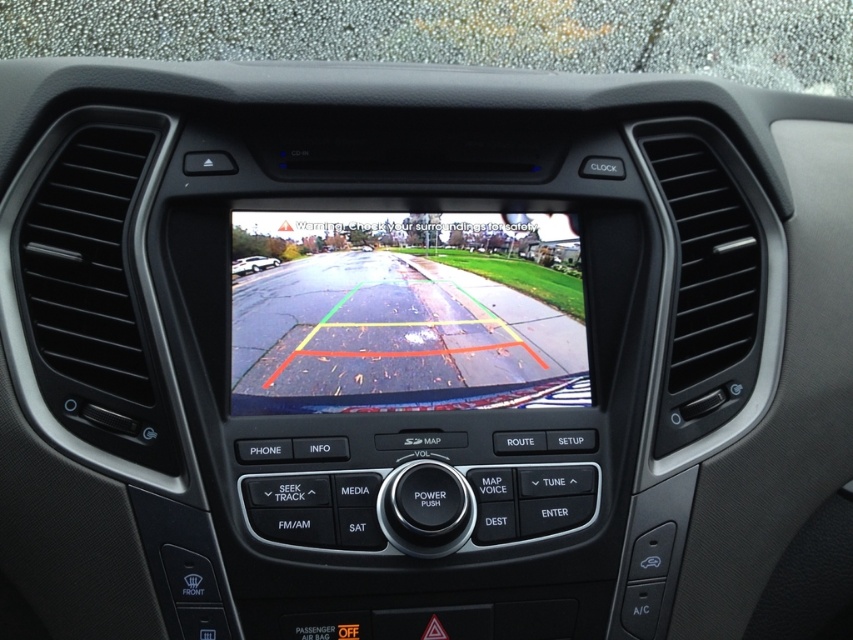
Question: Among these objects, which one is farthest from the camera?

Choices:
 (A) white glossy car at center
 (B) transparent plastic view mirror at center

Answer: (A)

Question: Can you confirm if transparent plastic view mirror at center is positioned to the right of white glossy car at center?

Choices:
 (A) yes
 (B) no

Answer: (A)

Question: Is transparent plastic view mirror at center above white glossy car at center?

Choices:
 (A) yes
 (B) no

Answer: (B)

Question: Which object is closer to the camera taking this photo?

Choices:
 (A) transparent plastic view mirror at center
 (B) white glossy car at center

Answer: (A)

Question: Can you confirm if transparent plastic view mirror at center is positioned to the right of white glossy car at center?

Choices:
 (A) yes
 (B) no

Answer: (A)